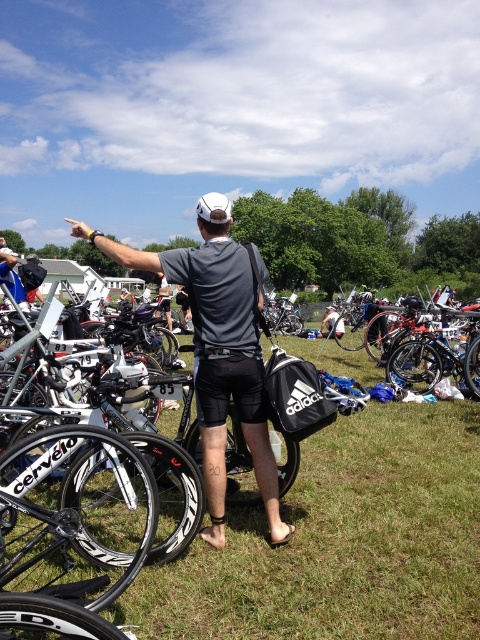
Question: Can you confirm if green grass at center is wider than shiny black bicycle at center?

Choices:
 (A) no
 (B) yes

Answer: (B)

Question: Which object appears farthest from the camera in this image?

Choices:
 (A) white matte shorts at center
 (B) shiny black bicycle at center

Answer: (A)

Question: Which of these objects is positioned closest to the shiny black bicycle at center?

Choices:
 (A) gray matte shirt at center
 (B) green grass at center

Answer: (A)

Question: Considering the real-world distances, which object is closest to the shiny black bicycle at center?

Choices:
 (A) green grass at center
 (B) white matte shorts at center
 (C) gray matte shirt at center

Answer: (C)

Question: Can you confirm if green grass at center is positioned above gray matte shirt at center?

Choices:
 (A) no
 (B) yes

Answer: (A)

Question: Is gray matte shirt at center to the right of white matte shorts at center from the viewer's perspective?

Choices:
 (A) yes
 (B) no

Answer: (B)